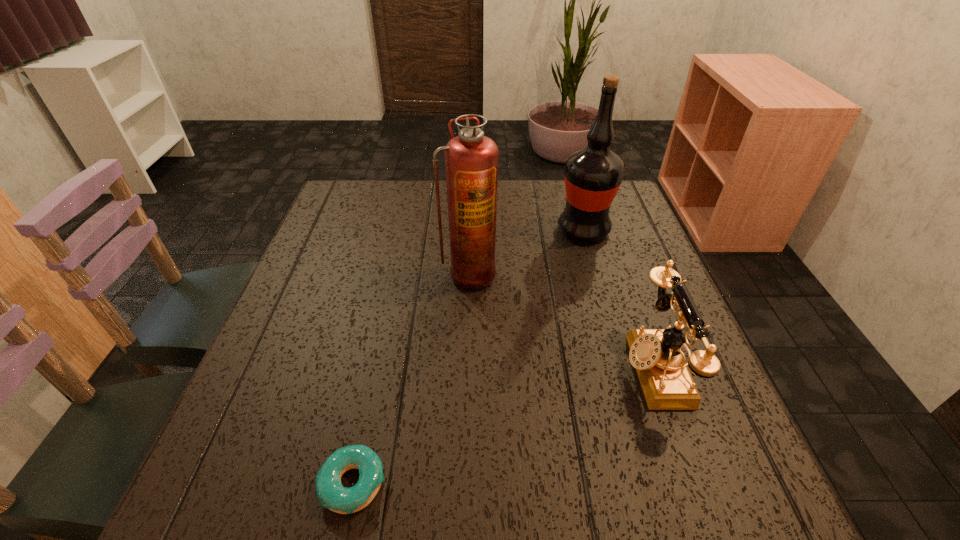
Where is `free space at the left edge of the desktop`? This screenshot has height=540, width=960. free space at the left edge of the desktop is located at coordinates (260, 377).

Where is `vacant space at the right edge of the desktop`? This screenshot has width=960, height=540. vacant space at the right edge of the desktop is located at coordinates (588, 246).

The height and width of the screenshot is (540, 960). Find the location of `free location at the far right corner`. free location at the far right corner is located at coordinates (616, 223).

At what (x,y) coordinates should I click in order to perform the action: click on free space at the near right corner of the desktop. Please return your answer as a coordinate pair (x, y). The width and height of the screenshot is (960, 540). Looking at the image, I should click on (737, 470).

This screenshot has width=960, height=540. What are the coordinates of `free spot between the second nearest object and the fire extinguisher` in the screenshot? It's located at (562, 321).

At what (x,y) coordinates should I click in order to perform the action: click on empty space between the third object from right to left and the second nearest object. Please return your answer as a coordinate pair (x, y). The height and width of the screenshot is (540, 960). Looking at the image, I should click on (562, 321).

What are the coordinates of `vacant space that's between the shortest object and the third tallest object` in the screenshot? It's located at (504, 426).

The image size is (960, 540). I want to click on free space between the farthest object and the nearest object, so click(468, 357).

Where is `free space between the third tallest object and the wine bottle`? free space between the third tallest object and the wine bottle is located at coordinates (619, 299).

Where is `vacant region between the wine bottle and the third tallest object`? The image size is (960, 540). vacant region between the wine bottle and the third tallest object is located at coordinates (619, 299).